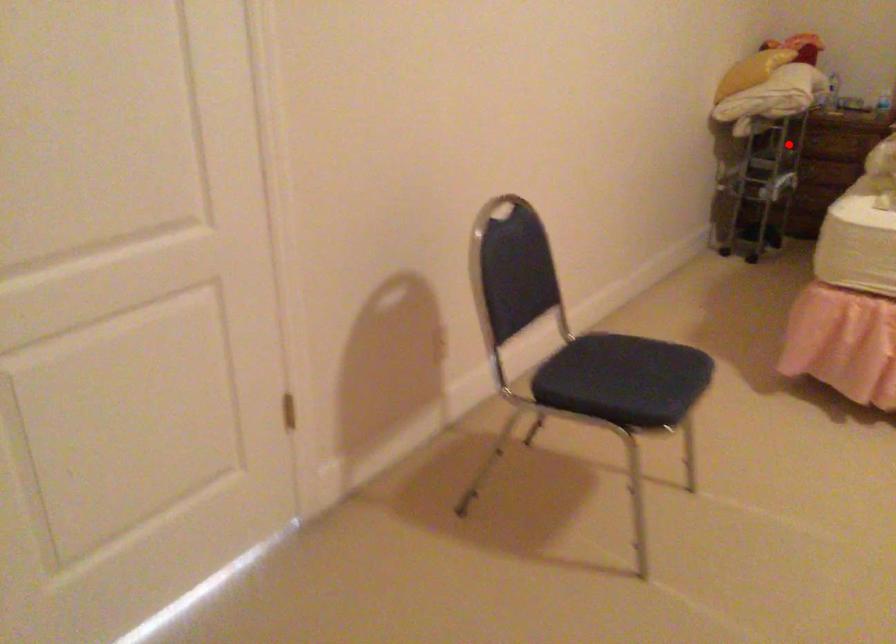
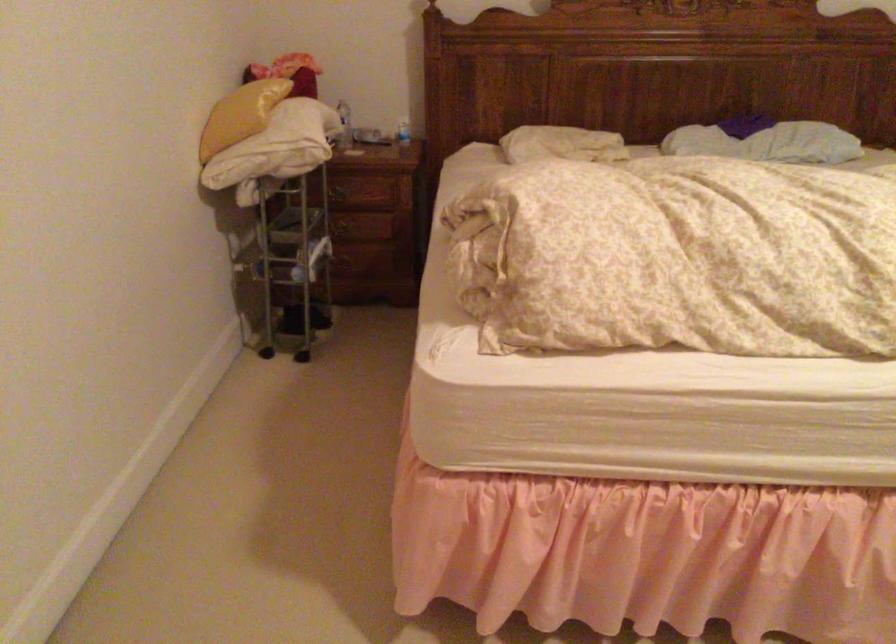
Locate, in the second image, the point that corresponds to the highlighted location in the first image.

(342, 230)